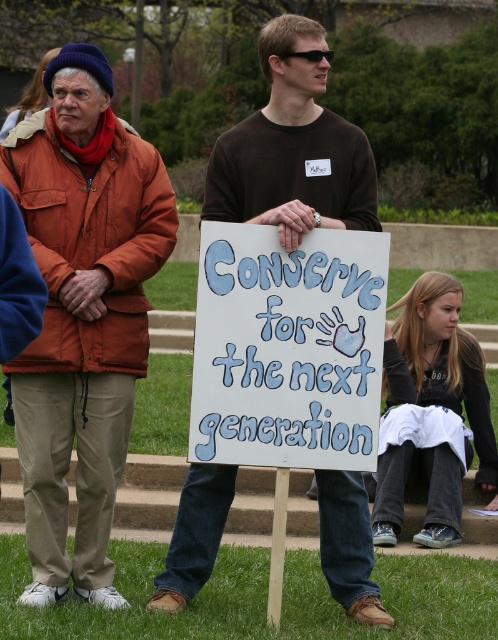
Between point (59, 225) and point (293, 257), which one is positioned in front?

Positioned in front is point (293, 257).

Who is lower down, orange fabric jacket at left or white painted wood sign at center?

Positioned lower is white painted wood sign at center.

Between point (129, 205) and point (207, 241), which one is positioned in front?

Positioned in front is point (207, 241).

The width and height of the screenshot is (498, 640). Find the location of `orange fabric jacket at left`. orange fabric jacket at left is located at coordinates (82, 314).

Is orange fabric jacket at left further to camera compared to brown cotton shirt at center?

Yes, it is.

You are a GUI agent. You are given a task and a screenshot of the screen. Output one action in this format:
    pyautogui.click(x=<x>, y=<y>)
    Task: Click on the orange fabric jacket at left
    
    Given the screenshot: What is the action you would take?
    82,314

Identify the location of orange fabric jacket at left. (82, 314).

Is white painted wood sign at center below black cotton shirt at lower right?

No.

Consider the image. Who is more distant from viewer, (330, 284) or (417, 339)?

Point (417, 339)

The height and width of the screenshot is (640, 498). Describe the element at coordinates (287, 348) in the screenshot. I see `white painted wood sign at center` at that location.

Find the location of `white painted wood sign at center`. white painted wood sign at center is located at coordinates (287, 348).